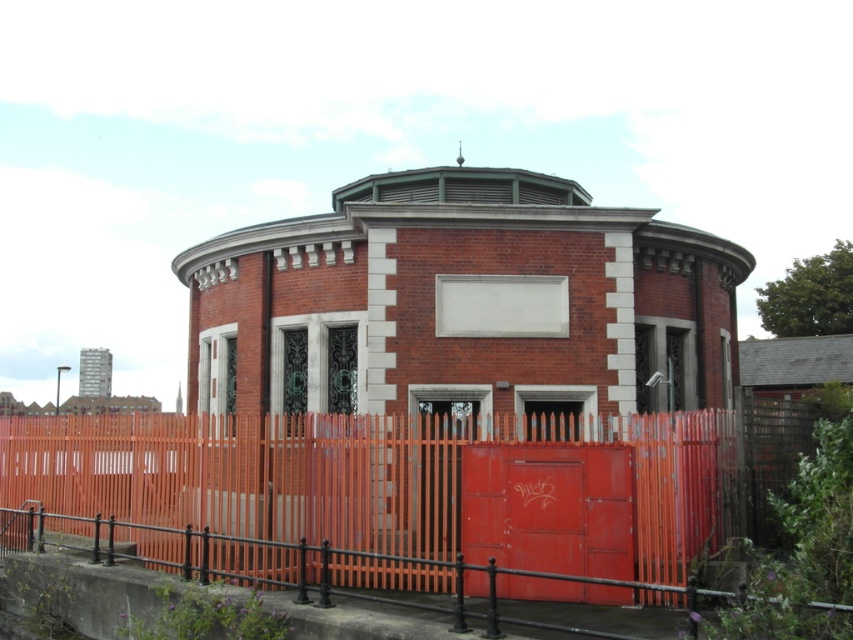
Does orange wooden fence at lower left have a greater width compared to metallic red door at center?

Yes.

Does orange wooden fence at lower left have a larger size compared to metallic red door at center?

Yes.

At what (x,y) coordinates should I click in order to perform the action: click on orange wooden fence at lower left. Please return your answer as a coordinate pair (x, y). Looking at the image, I should click on (354, 476).